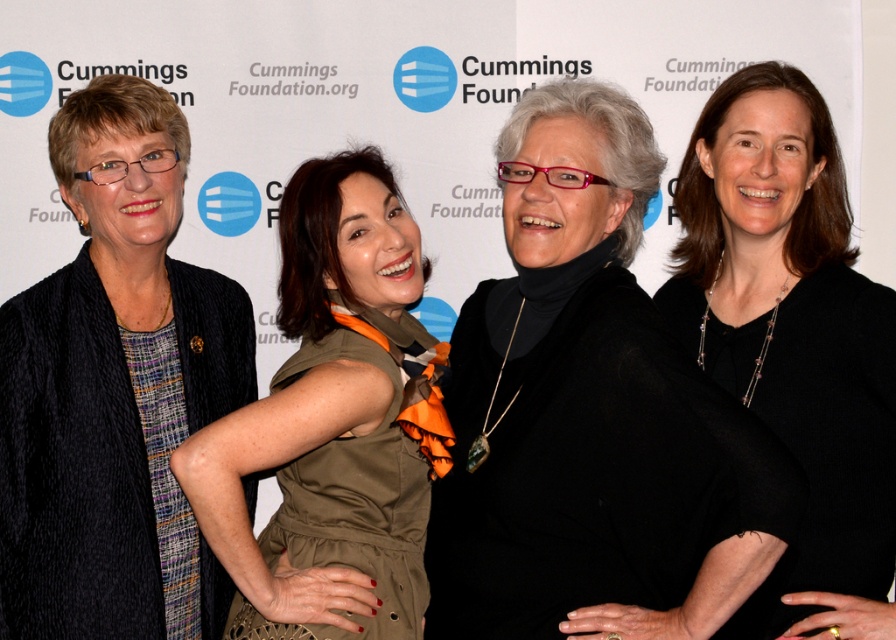
Question: Is black matte sweater at center to the left of matte olive green dress at center from the viewer's perspective?

Choices:
 (A) no
 (B) yes

Answer: (A)

Question: Which is nearer to the black matte dress at right?

Choices:
 (A) matte olive green dress at center
 (B) matte black cardigan at left

Answer: (A)

Question: Which object is positioned closest to the matte black cardigan at left?

Choices:
 (A) black matte dress at right
 (B) black matte sweater at center
 (C) matte olive green dress at center

Answer: (C)

Question: Considering the real-world distances, which object is closest to the matte olive green dress at center?

Choices:
 (A) black matte sweater at center
 (B) matte black cardigan at left
 (C) black matte dress at right

Answer: (A)

Question: Is matte black cardigan at left to the right of matte olive green dress at center from the viewer's perspective?

Choices:
 (A) yes
 (B) no

Answer: (B)

Question: Can you confirm if black matte sweater at center is bigger than black matte dress at right?

Choices:
 (A) no
 (B) yes

Answer: (B)